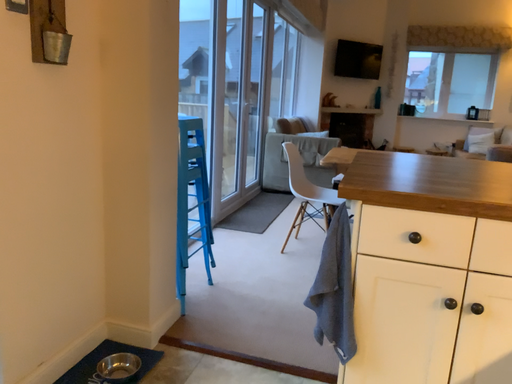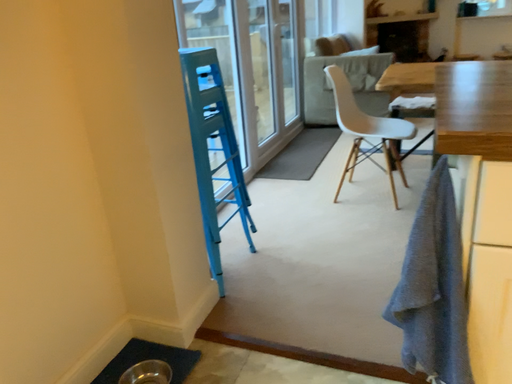
Question: How did the camera likely rotate when shooting the video?

Choices:
 (A) rotated upward
 (B) rotated downward

Answer: (B)